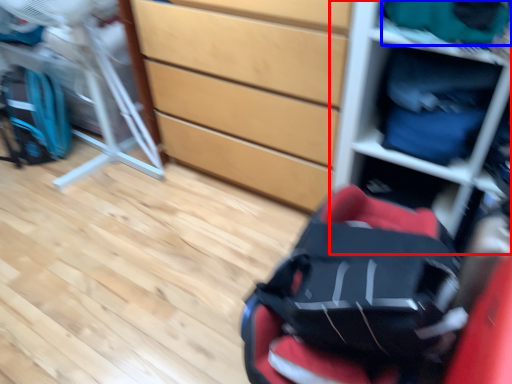
Question: Which point is closer to the camera, shelf (highlighted by a red box) or clothing (highlighted by a blue box)?

Choices:
 (A) shelf
 (B) clothing

Answer: (A)